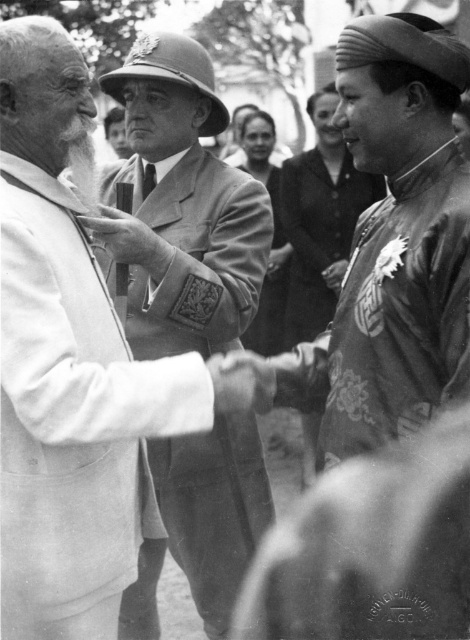
Question: Does matte gold medallion at center come behind black silk tie at center?

Choices:
 (A) no
 (B) yes

Answer: (A)

Question: Among these objects, which one is farthest from the camera?

Choices:
 (A) smooth fabric uniform at center
 (B) black silk tie at center

Answer: (B)

Question: Can you confirm if smooth fabric uniform at center is smaller than matte gold medallion at center?

Choices:
 (A) yes
 (B) no

Answer: (B)

Question: Considering the relative positions of matte gold medallion at center and black silk tie at center in the image provided, where is matte gold medallion at center located with respect to black silk tie at center?

Choices:
 (A) above
 (B) below

Answer: (B)

Question: Which point is closer to the camera?

Choices:
 (A) matte gold medallion at center
 (B) black silk tie at center

Answer: (A)

Question: Among these objects, which one is farthest from the camera?

Choices:
 (A) black silk tie at center
 (B) matte gold medallion at center

Answer: (A)